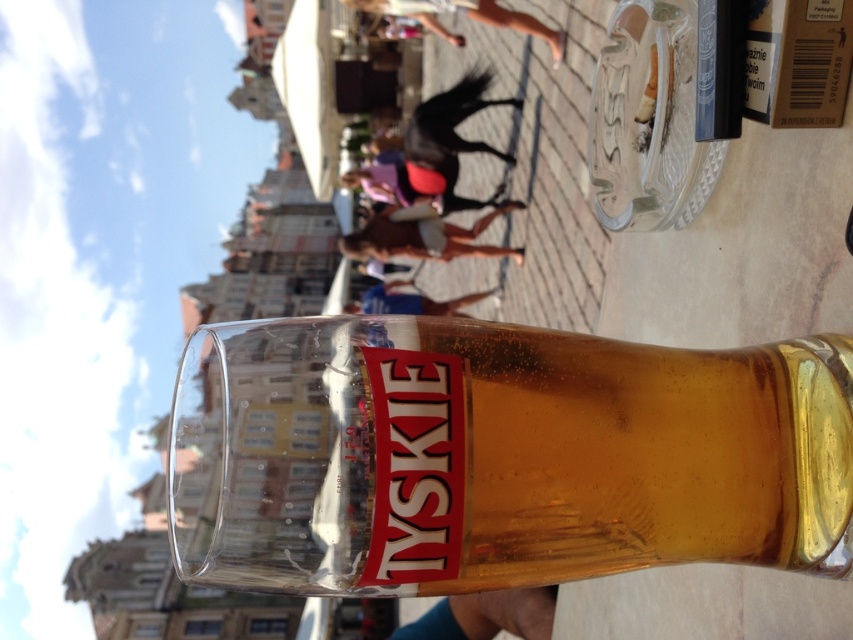
Is point (384, 481) closer to viewer compared to point (486, 291)?

Yes.

From the picture: Can you confirm if translucent glass mug at center is smaller than smooth skin person at center?

Incorrect, translucent glass mug at center is not smaller in size than smooth skin person at center.

Locate an element on the screen. The height and width of the screenshot is (640, 853). translucent glass mug at center is located at coordinates (498, 456).

From the picture: Who is more distant from viewer, (612, 442) or (354, 236)?

Positioned behind is point (354, 236).

Who is positioned more to the right, translucent glass mug at center or tan fabric shorts at center?

From the viewer's perspective, translucent glass mug at center appears more on the right side.

Is point (639, 492) behind point (444, 252)?

That is False.

Find the location of a particular element. translucent glass mug at center is located at coordinates (498, 456).

Is tan fabric shorts at center taller than smooth skin person at center?

No.

Can you confirm if tan fabric shorts at center is thinner than smooth skin person at center?

No.

Where is `tan fabric shorts at center`? The width and height of the screenshot is (853, 640). tan fabric shorts at center is located at coordinates (425, 237).